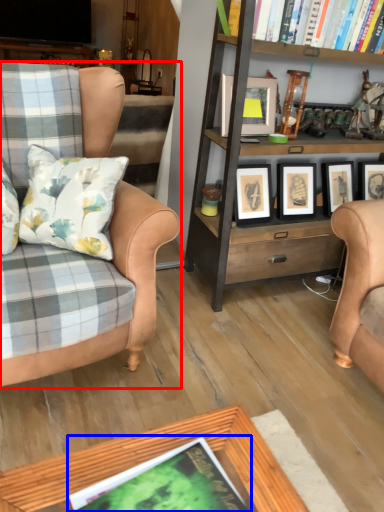
Question: Which object is closer to the camera taking this photo, chair (highlighted by a red box) or book (highlighted by a blue box)?

Choices:
 (A) chair
 (B) book

Answer: (B)